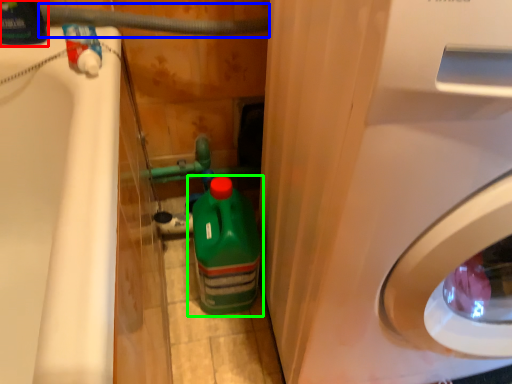
Question: Which object is positioned closest to cleaning product (highlighted by a red box)? Select from water pipe (highlighted by a blue box) and bottle (highlighted by a green box).

Choices:
 (A) water pipe
 (B) bottle

Answer: (A)